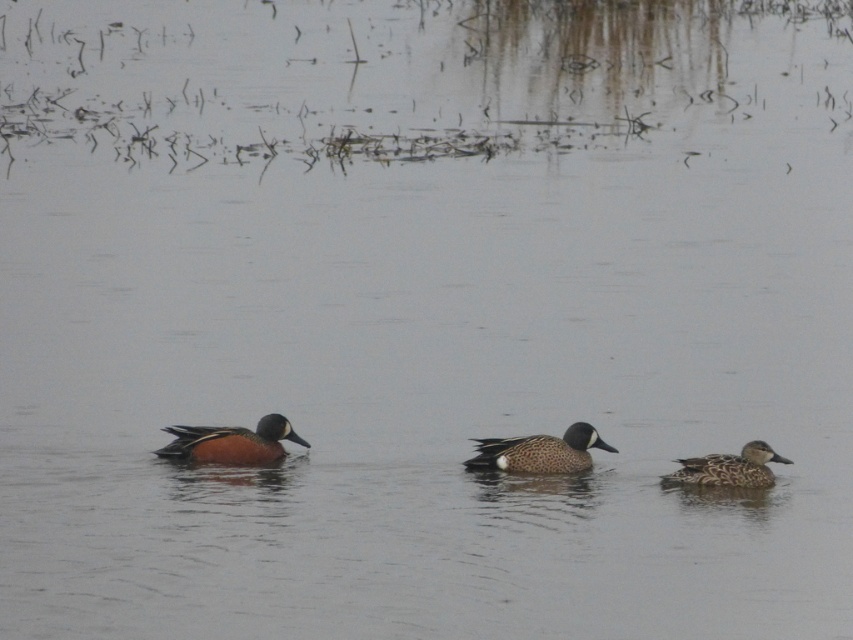
You are a wildlife photographer aiming to capture a closeup of the speckled feathered duck at center and the speckled brown duck at right. Based on their sizes, which duck should you choose a wider lens for to ensure the entire duck fits in the frame?

The speckled feathered duck at center has a larger size compared to the speckled brown duck at right, so you should choose a wider lens for the speckled feathered duck at center to ensure it fits entirely in the frame.

You are a photographer trying to capture the blue speckled duck at left in the image. Based on its coordinates, where should you aim your camera to ensure it is centered in your shot?

You should aim your camera at the coordinates point [231,442] to center the blue speckled duck at left in your shot.